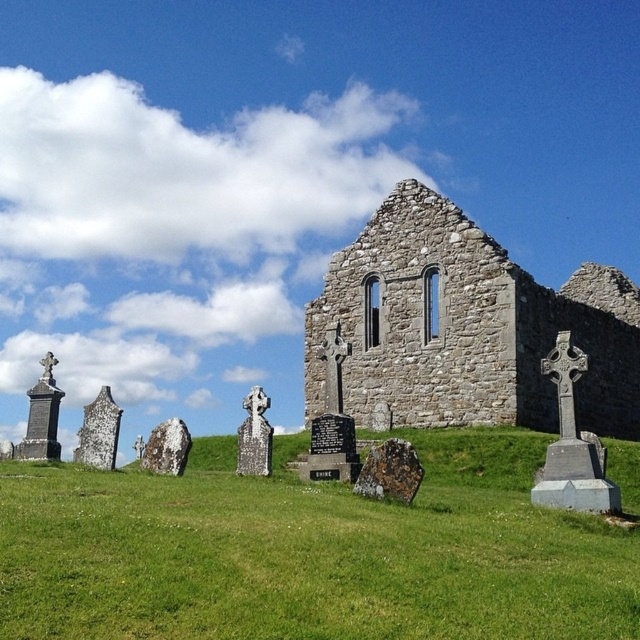
Can you confirm if green grass at center is bigger than stone wall at center?

Actually, green grass at center might be smaller than stone wall at center.

You are a GUI agent. You are given a task and a screenshot of the screen. Output one action in this format:
    pyautogui.click(x=<x>, y=<y>)
    Task: Click on the green grass at center
    The image size is (640, 640).
    Given the screenshot: What is the action you would take?
    pyautogui.click(x=310, y=550)

Between green grass at center and brown stone gravestone at center, which one appears on the left side from the viewer's perspective?

From the viewer's perspective, green grass at center appears more on the left side.

Looking at this image, does green grass at center have a lesser height compared to brown stone gravestone at center?

No.

Image resolution: width=640 pixels, height=640 pixels. Describe the element at coordinates (310, 550) in the screenshot. I see `green grass at center` at that location.

Locate an element on the screen. This screenshot has height=640, width=640. green grass at center is located at coordinates (310, 550).

Is point (497, 381) closer to camera compared to point (374, 476)?

No, (497, 381) is behind (374, 476).

Is stone wall at center taller than brown stone gravestone at center?

Correct, stone wall at center is much taller as brown stone gravestone at center.

I want to click on stone wall at center, so click(x=467, y=326).

Image resolution: width=640 pixels, height=640 pixels. Find the location of `stone wall at center`. stone wall at center is located at coordinates (467, 326).